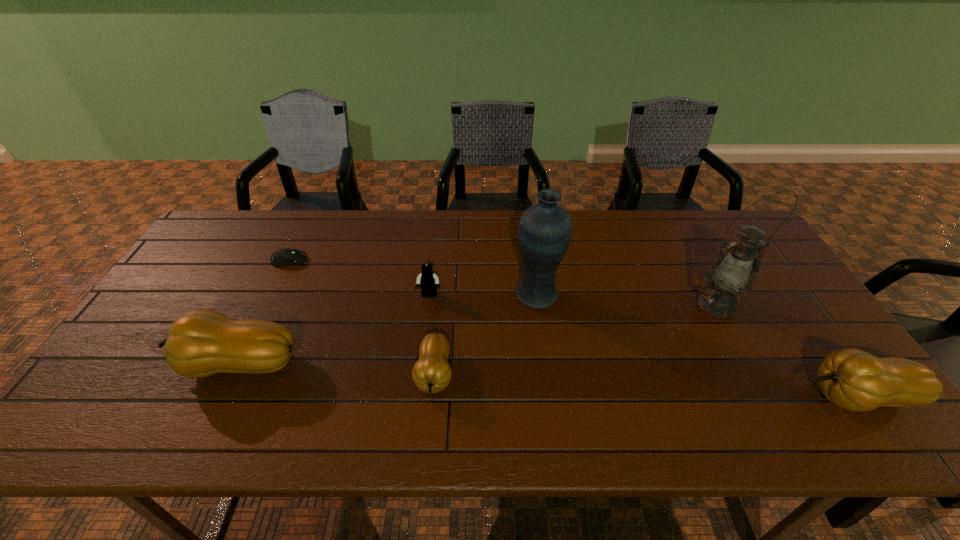
At what (x,y) coordinates should I click in order to perform the action: click on free space between the second tallest object and the leftmost gourd. Please return your answer as a coordinate pair (x, y). Image resolution: width=960 pixels, height=540 pixels. Looking at the image, I should click on (387, 329).

Where is `free space between the second tallest object and the third shortest object`? The width and height of the screenshot is (960, 540). free space between the second tallest object and the third shortest object is located at coordinates (483, 295).

What are the coordinates of `free space that is in between the leftmost gourd and the second object from right to left` in the screenshot? It's located at (476, 334).

Find the location of a particular element. free space between the shortest gourd and the sixth shortest object is located at coordinates 486,335.

Locate an element on the screen. This screenshot has width=960, height=540. free space between the oil lamp and the second shortest object is located at coordinates (575, 339).

You are a GUI agent. You are given a task and a screenshot of the screen. Output one action in this format:
    pyautogui.click(x=<x>, y=<y>)
    Task: Click on the vacant area that lies between the second object from right to left and the computer equipment
    
    Given the screenshot: What is the action you would take?
    pyautogui.click(x=503, y=282)

Identify the location of free space between the sixth tallest object and the sixth object from left to right. This screenshot has height=540, width=960. (575, 339).

Find the location of a particular element. free spot between the second shortest gourd and the Lego is located at coordinates (643, 346).

In order to click on empty space between the leftmost gourd and the farthest object in this screenshot , I will do `click(262, 312)`.

Where is `vacant point located between the second tallest gourd and the oil lamp`? vacant point located between the second tallest gourd and the oil lamp is located at coordinates (787, 350).